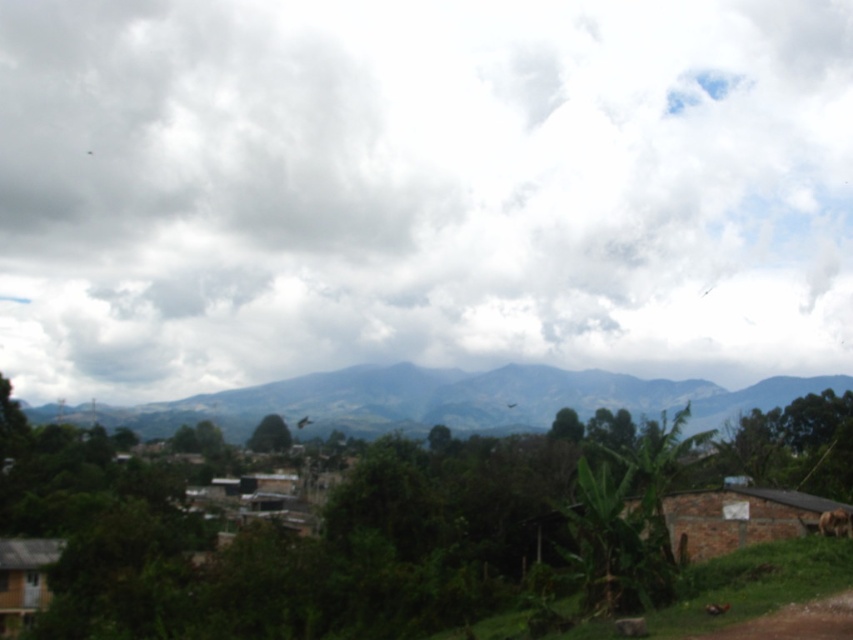
You are standing at the origin point in the rural landscape scene. There are two points marked as point0 and point1. Point0 has coordinates point0 at (772, 525) and point1 has coordinates point1 at (798, 627). Which point is closer to you?

Point1 at (798, 627) is closer to you because point0 at (772, 525) is behind it.